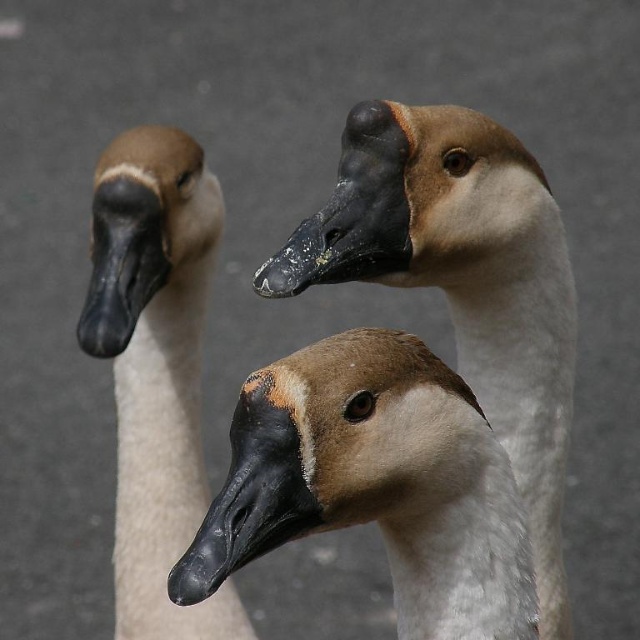
Question: In this image, where is brown matte swan at center located relative to matte brown goose at left?

Choices:
 (A) below
 (B) above

Answer: (A)

Question: Which object is closer to the camera taking this photo?

Choices:
 (A) matte brown goose at center
 (B) matte brown goose at left
 (C) matte black goose head at left

Answer: (A)

Question: Among these points, which one is nearest to the camera?

Choices:
 (A) (458, 305)
 (B) (480, 499)
 (C) (116, 147)
 (D) (520, 205)

Answer: (B)

Question: Considering the relative positions of matte brown goose at center and brown matte goose head at center in the image provided, where is matte brown goose at center located with respect to brown matte goose head at center?

Choices:
 (A) below
 (B) above

Answer: (A)

Question: Among these objects, which one is nearest to the camera?

Choices:
 (A) brown matte swan at center
 (B) brown matte goose head at center

Answer: (A)

Question: Does matte brown goose at left appear over brown matte goose head at center?

Choices:
 (A) yes
 (B) no

Answer: (B)